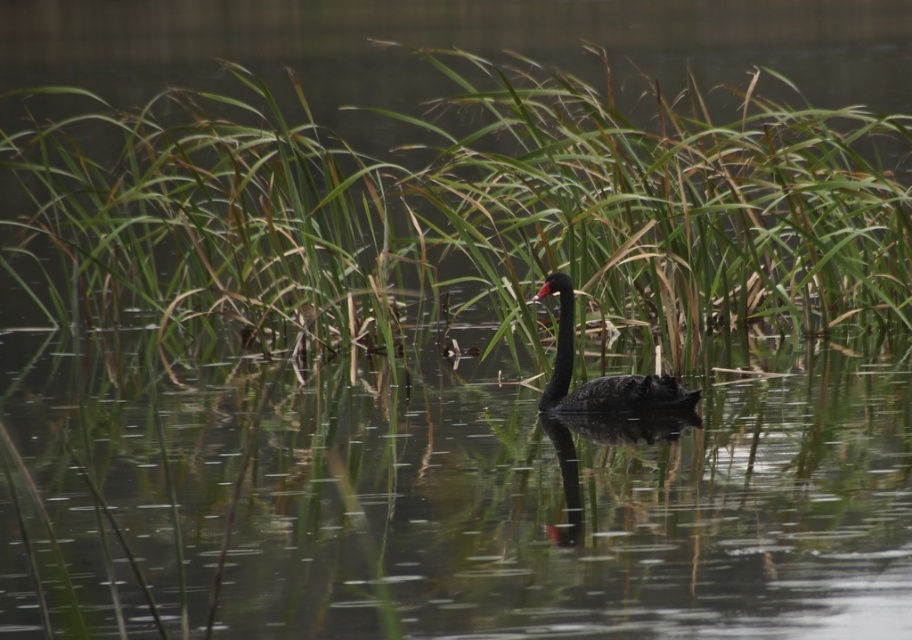
Question: Does green grass at center appear over shiny black swan at center?

Choices:
 (A) no
 (B) yes

Answer: (B)

Question: Among these objects, which one is farthest from the camera?

Choices:
 (A) green grass at center
 (B) shiny black swan at center

Answer: (A)

Question: Can you confirm if green grass at center is bigger than shiny black swan at center?

Choices:
 (A) yes
 (B) no

Answer: (A)

Question: Which point appears closest to the camera in this image?

Choices:
 (A) (379, 257)
 (B) (630, 400)

Answer: (B)

Question: Which point appears closest to the camera in this image?

Choices:
 (A) (384, 349)
 (B) (560, 342)

Answer: (B)

Question: Does green grass at center have a lesser width compared to shiny black swan at center?

Choices:
 (A) no
 (B) yes

Answer: (A)